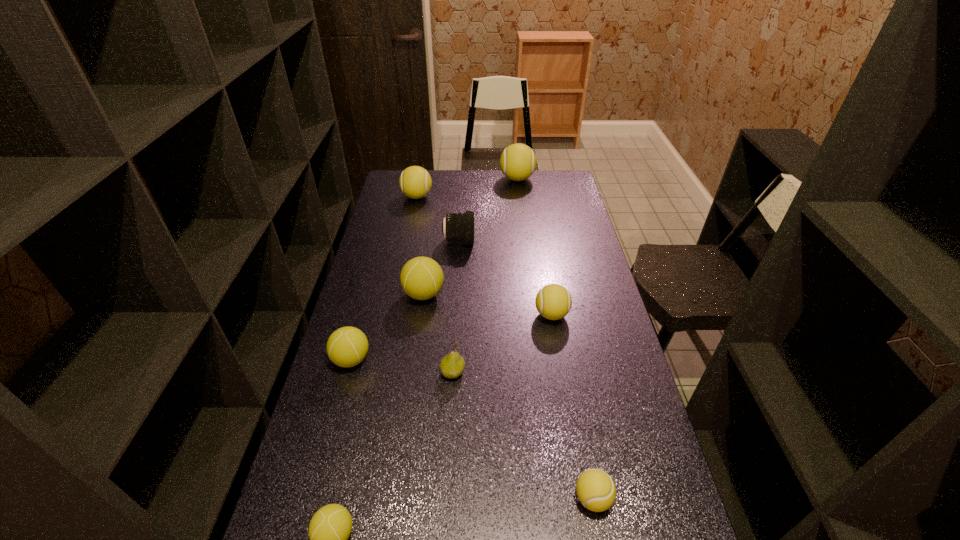
Locate which object is the closest to the telephoto lens. Please provide its 2D coordinates. Your answer should be formatted as a tuple, i.e. [(x, y)], where the tuple contains the x and y coordinates of a point satisfying the conditions above.

[(421, 278)]

Select which object appears as the fourth closest to the leftmost yellow tennis ball. Please provide its 2D coordinates. Your answer should be formatted as a tuple, i.e. [(x, y)], where the tuple contains the x and y coordinates of a point satisfying the conditions above.

[(553, 301)]

Locate an element on the screen. The width and height of the screenshot is (960, 540). tennis ball that is the third closest one to the nearest yellow tennis ball is located at coordinates (346, 347).

Locate which tennis ball is the sixth closest to the green pear. Please provide its 2D coordinates. Your answer should be formatted as a tuple, i.e. [(x, y)], where the tuple contains the x and y coordinates of a point satisfying the conditions above.

[(415, 182)]

I want to click on yellow tennis ball that is the third closest to the second farthest green tennis ball, so click(415, 182).

Select which yellow tennis ball appears as the closest to the biggest green tennis ball. Please provide its 2D coordinates. Your answer should be formatted as a tuple, i.e. [(x, y)], where the tuple contains the x and y coordinates of a point satisfying the conditions above.

[(553, 301)]

The height and width of the screenshot is (540, 960). What are the coordinates of `green tennis ball that is the third nearest to the smallest yellow tennis ball` in the screenshot? It's located at (421, 278).

At what (x,y) coordinates should I click in order to perform the action: click on green tennis ball identified as the second closest to the green pear. Please return your answer as a coordinate pair (x, y). Looking at the image, I should click on (421, 278).

Where is `free space that satisfies the following two spatial constraints: 1. on the back side of the second smallest green tennis ball; 2. on the right side of the third smallest yellow tennis ball`? This screenshot has width=960, height=540. free space that satisfies the following two spatial constraints: 1. on the back side of the second smallest green tennis ball; 2. on the right side of the third smallest yellow tennis ball is located at coordinates (396, 197).

I want to click on vacant space that satisfies the following two spatial constraints: 1. on the front side of the pear; 2. on the right side of the second farthest green tennis ball, so click(x=348, y=372).